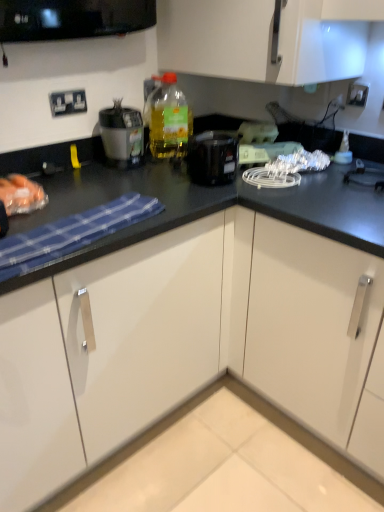
Where is `translucent plastic bottle at upper center`? translucent plastic bottle at upper center is located at coordinates (168, 120).

Measure the distance between white glossy cabinet at lower center and camera.

They are 37.57 inches apart.

The height and width of the screenshot is (512, 384). Find the location of `matte black blender at upper left`. matte black blender at upper left is located at coordinates (122, 134).

Could you tell me if white plastic electric outlet at upper right, which is counted as the second electric outlet, starting from the left, is facing black plastic coffee maker at center?

Yes, white plastic electric outlet at upper right, which is counted as the second electric outlet, starting from the left, is facing black plastic coffee maker at center.

Based on their sizes in the image, would you say white plastic electric outlet at upper right, which is counted as the second electric outlet, starting from the left, is bigger or smaller than black plastic coffee maker at center?

Considering their sizes, white plastic electric outlet at upper right, which is counted as the second electric outlet, starting from the left, takes up less space than black plastic coffee maker at center.

Which object is thinner, white plastic electric outlet at upper right, the 1th electric outlet viewed from the right, or black plastic coffee maker at center?

white plastic electric outlet at upper right, the 1th electric outlet viewed from the right.

Is translucent plastic bottle at upper center not near white glossy cabinet at lower center?

That's not correct — translucent plastic bottle at upper center is a little close to white glossy cabinet at lower center.

Can you confirm if translucent plastic bottle at upper center is smaller than white glossy cabinet at lower center?

Correct, translucent plastic bottle at upper center occupies less space than white glossy cabinet at lower center.

From a real-world perspective, who is located higher, translucent plastic bottle at upper center or white glossy cabinet at lower center?

translucent plastic bottle at upper center.

Looking at this image, from the image's perspective, is white glossy cabinet at lower center located beneath white plastic electric outlet at upper right, the 1th electric outlet viewed from the right?

Correct, white glossy cabinet at lower center appears lower than white plastic electric outlet at upper right, the 1th electric outlet viewed from the right, in the image.

How different are the orientations of white glossy cabinet at lower center and white plastic electric outlet at upper right, which is counted as the second electric outlet, starting from the left, in degrees?

white glossy cabinet at lower center and white plastic electric outlet at upper right, which is counted as the second electric outlet, starting from the left, are facing 0.115 degrees away from each other.

Is white glossy cabinet at lower center wider than white plastic electric outlet at upper right, which is counted as the second electric outlet, starting from the left?

Yes.

Is white glossy cabinet at lower center facing towards white plastic electric outlet at upper right, which is counted as the second electric outlet, starting from the left?

No, white glossy cabinet at lower center does not turn towards white plastic electric outlet at upper right, which is counted as the second electric outlet, starting from the left.

Can we say matte black blender at upper left lies outside black plastic coffee maker at center?

Absolutely, matte black blender at upper left is external to black plastic coffee maker at center.

Image resolution: width=384 pixels, height=512 pixels. In order to click on kitchen appliance that is below the matte black blender at upper left (from the image's perspective) in this screenshot , I will do `click(213, 157)`.

Is matte black blender at upper left in front of or behind black plastic coffee maker at center in the image?

Clearly, matte black blender at upper left is behind black plastic coffee maker at center.

Can you confirm if matte black blender at upper left is shorter than black plastic coffee maker at center?

No, matte black blender at upper left is not shorter than black plastic coffee maker at center.

From a real-world perspective, is matte black blender at upper left located higher than white plastic electrical outlet at upper left, arranged as the second electric outlet when viewed from the right?

No, from a real-world perspective, matte black blender at upper left is not above white plastic electrical outlet at upper left, arranged as the second electric outlet when viewed from the right.

Considering the relative sizes of matte black blender at upper left and white plastic electrical outlet at upper left, arranged as the second electric outlet when viewed from the right, in the image provided, is matte black blender at upper left thinner than white plastic electrical outlet at upper left, arranged as the second electric outlet when viewed from the right,?

In fact, matte black blender at upper left might be wider than white plastic electrical outlet at upper left, arranged as the second electric outlet when viewed from the right.

Is matte black blender at upper left facing towards white plastic electrical outlet at upper left, arranged as the second electric outlet when viewed from the right?

No, matte black blender at upper left is not turned towards white plastic electrical outlet at upper left, arranged as the second electric outlet when viewed from the right.

Does white glossy cabinet at lower center turn towards white plastic electrical outlet at upper left, which is the 1th electric outlet from left to right?

No, white glossy cabinet at lower center is not facing towards white plastic electrical outlet at upper left, which is the 1th electric outlet from left to right.

Is point (307, 277) closer to camera compared to point (59, 92)?

Yes, point (307, 277) is in front of point (59, 92).

The height and width of the screenshot is (512, 384). Identify the location of cabinetry below the white plastic electrical outlet at upper left, arranged as the second electric outlet when viewed from the right (from a real-world perspective). (179, 341).

From a real-world perspective, is white glossy cabinet at lower center located higher than white plastic electrical outlet at upper left, which is the 1th electric outlet from left to right?

No, from a real-world perspective, white glossy cabinet at lower center is not on top of white plastic electrical outlet at upper left, which is the 1th electric outlet from left to right.

In the scene shown: Is translucent plastic bottle at upper center directly adjacent to white plastic electric outlet at upper right, which is counted as the second electric outlet, starting from the left?

No, translucent plastic bottle at upper center is not next to white plastic electric outlet at upper right, which is counted as the second electric outlet, starting from the left.

Is translucent plastic bottle at upper center shorter than white plastic electric outlet at upper right, the 1th electric outlet viewed from the right?

Incorrect, the height of translucent plastic bottle at upper center does not fall short of that of white plastic electric outlet at upper right, the 1th electric outlet viewed from the right.

Is translucent plastic bottle at upper center looking in the opposite direction of white plastic electric outlet at upper right, which is counted as the second electric outlet, starting from the left?

That's not correct — translucent plastic bottle at upper center is not looking away from white plastic electric outlet at upper right, which is counted as the second electric outlet, starting from the left.

The image size is (384, 512). Find the location of `electric outlet that appears on the right of black plastic coffee maker at center`. electric outlet that appears on the right of black plastic coffee maker at center is located at coordinates (357, 94).

The width and height of the screenshot is (384, 512). In order to click on bottle above the white glossy cabinet at lower center (from a real-world perspective) in this screenshot , I will do `click(168, 120)`.

Based on the photo, which object lies nearer to the anchor point black plastic coffee maker at center, matte black blender at upper left or white plastic electric outlet at upper right, which is counted as the second electric outlet, starting from the left?

A: Based on the image, matte black blender at upper left appears to be nearer to black plastic coffee maker at center.

Considering their positions, is white plastic electrical outlet at upper left, arranged as the second electric outlet when viewed from the right, positioned closer to black plastic coffee maker at center than translucent plastic bottle at upper center?

Among the two, translucent plastic bottle at upper center is located nearer to black plastic coffee maker at center.

Looking at the image, which one is located closer to matte black blender at upper left, translucent plastic bottle at upper center or white plastic electric outlet at upper right, which is counted as the second electric outlet, starting from the left?

Based on the image, translucent plastic bottle at upper center appears to be nearer to matte black blender at upper left.

Considering their positions, is white glossy cabinet at lower center positioned closer to translucent plastic bottle at upper center than black plastic coffee maker at center?

Among the two, black plastic coffee maker at center is located nearer to translucent plastic bottle at upper center.

When comparing their distances from white plastic electric outlet at upper right, which is counted as the second electric outlet, starting from the left, does black plastic coffee maker at center or translucent plastic bottle at upper center seem further?

translucent plastic bottle at upper center is positioned further to the anchor white plastic electric outlet at upper right, which is counted as the second electric outlet, starting from the left.

When comparing their distances from white plastic electric outlet at upper right, which is counted as the second electric outlet, starting from the left, does translucent plastic bottle at upper center or matte black blender at upper left seem further?

Based on the image, matte black blender at upper left appears to be further to white plastic electric outlet at upper right, which is counted as the second electric outlet, starting from the left.

From the image, which object appears to be farther from white plastic electrical outlet at upper left, which is the 1th electric outlet from left to right, translucent plastic bottle at upper center or black plastic coffee maker at center?

black plastic coffee maker at center lies further to white plastic electrical outlet at upper left, which is the 1th electric outlet from left to right, than the other object.

From the image, which object appears to be nearer to white plastic electric outlet at upper right, the 1th electric outlet viewed from the right, white glossy cabinet at lower center or white plastic electrical outlet at upper left, which is the 1th electric outlet from left to right?

white plastic electrical outlet at upper left, which is the 1th electric outlet from left to right, lies closer to white plastic electric outlet at upper right, the 1th electric outlet viewed from the right, than the other object.

This screenshot has width=384, height=512. I want to click on kitchen appliance between translucent plastic bottle at upper center and white glossy cabinet at lower center in the up-down direction, so click(213, 157).

Find the location of a particular element. appliance between white plastic electrical outlet at upper left, arranged as the second electric outlet when viewed from the right, and white glossy cabinet at lower center, in the vertical direction is located at coordinates (122, 134).

At what (x,y) coordinates should I click in order to perform the action: click on kitchen appliance between matte black blender at upper left and white plastic electric outlet at upper right, the 1th electric outlet viewed from the right, in the horizontal direction. Please return your answer as a coordinate pair (x, y). Looking at the image, I should click on (213, 157).

The image size is (384, 512). Identify the location of kitchen appliance between white plastic electric outlet at upper right, the 1th electric outlet viewed from the right, and white glossy cabinet at lower center, in the vertical direction. (213, 157).